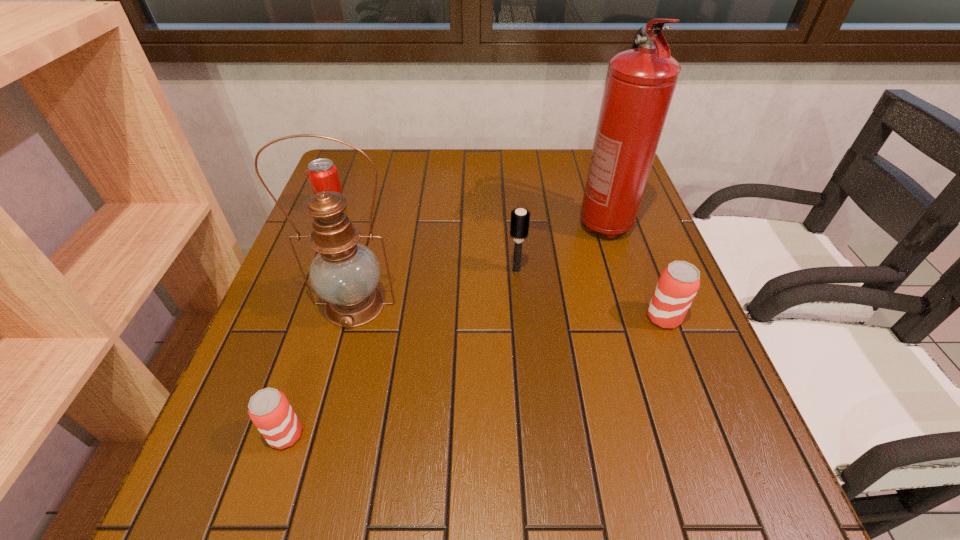
Where is `vacant space located 0.270m on the back of the right beer can`? vacant space located 0.270m on the back of the right beer can is located at coordinates point(629,227).

Find the location of a particular element. The height and width of the screenshot is (540, 960). free space located 0.090m on the right of the can is located at coordinates (378, 208).

Locate an element on the screen. Image resolution: width=960 pixels, height=540 pixels. free space located 0.110m on the back of the hairbrush is located at coordinates (514, 234).

This screenshot has height=540, width=960. I want to click on vacant space situated on the handle side the tallest object, so click(x=632, y=308).

Identify the location of free spot located 0.210m on the back of the oil lamp. Image resolution: width=960 pixels, height=540 pixels. (376, 224).

Locate an element on the screen. This screenshot has height=540, width=960. object present at the near edge is located at coordinates 269,409.

Where is `beer can at the left edge`? This screenshot has width=960, height=540. beer can at the left edge is located at coordinates (269, 409).

Identify the location of can that is at the left edge. This screenshot has height=540, width=960. (319, 179).

I want to click on oil lamp that is at the left edge, so pyautogui.click(x=345, y=273).

Where is `beer can that is at the right edge`? Image resolution: width=960 pixels, height=540 pixels. beer can that is at the right edge is located at coordinates (678, 284).